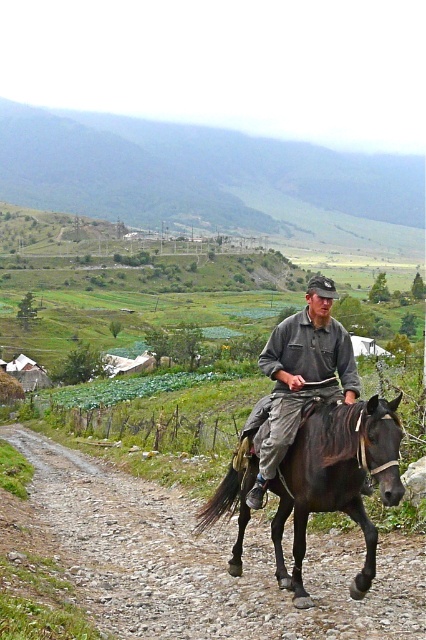
You are a hiker trying to find the path to the farmhouse. You see a gravelly dirt track at center and a gray cotton shirt at center. Which object is located to the left of the other?

The gravelly dirt track at center is positioned on the left side of gray cotton shirt at center, so the gravelly dirt track at center is to the left of the gray cotton shirt at center.

You are standing at the starting point of the gravel path in the rural scene. You see two points marked in the image. Which point is closer to you, point (408, 170) or point (311, 422)?

Point (408, 170) is closer to you because it is further to the viewer than point (311, 422).

You are a hiker planning to climb the green grassy hillside at upper center and then ride the shiny black horse at center to the next village. Based on the scene, which activity requires more physical effort?

Climbing the green grassy hillside at upper center requires more physical effort because it has a greater height compared to the shiny black horse at center, making the climb more strenuous.